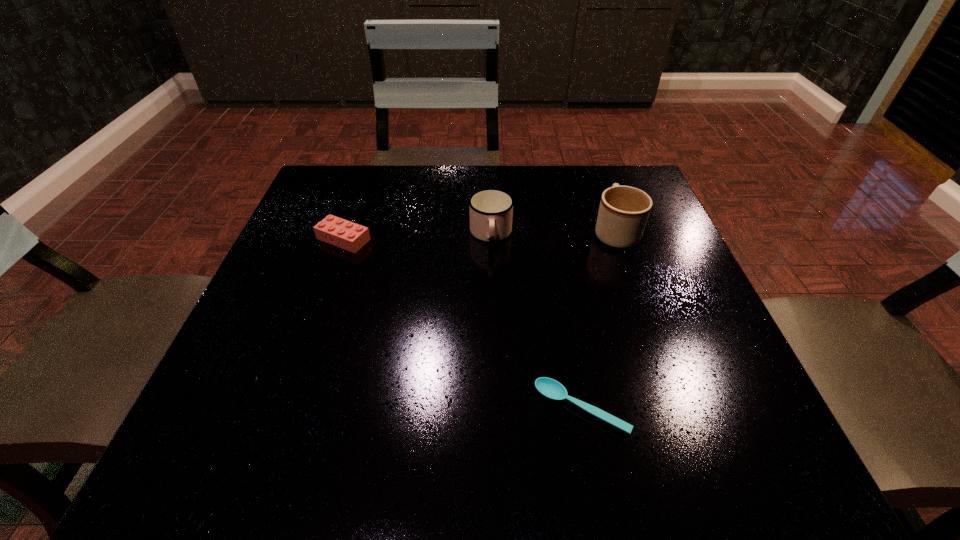
Identify the location of vacant space at the left edge of the desktop. The width and height of the screenshot is (960, 540). (273, 350).

The image size is (960, 540). In the image, there is a desktop. In order to click on free space at the right edge in this screenshot , I will do `click(683, 367)`.

The height and width of the screenshot is (540, 960). I want to click on free space at the far left corner, so click(322, 183).

In the image, there is a desktop. At what (x,y) coordinates should I click in order to perform the action: click on free region at the far right corner. Please return your answer as a coordinate pair (x, y). The width and height of the screenshot is (960, 540). Looking at the image, I should click on (639, 178).

Find the location of `unoccupied area between the nearest object and the tallest object`. unoccupied area between the nearest object and the tallest object is located at coordinates (598, 320).

At what (x,y) coordinates should I click in order to perform the action: click on blank region between the Lego and the third object from right to left. Please return your answer as a coordinate pair (x, y). The height and width of the screenshot is (540, 960). Looking at the image, I should click on (418, 237).

The image size is (960, 540). I want to click on vacant space in between the third object from right to left and the third tallest object, so click(418, 237).

What are the coordinates of `vacant space in between the second tallest object and the second object from right to left` in the screenshot? It's located at point(536,321).

You are a GUI agent. You are given a task and a screenshot of the screen. Output one action in this format:
    pyautogui.click(x=<x>, y=<y>)
    Task: Click on the vacant region between the shorter mug and the nearest object
    This screenshot has height=540, width=960.
    Given the screenshot: What is the action you would take?
    pyautogui.click(x=536, y=321)

What are the coordinates of `vacant area between the shortest object and the shorter mug` in the screenshot? It's located at (536, 321).